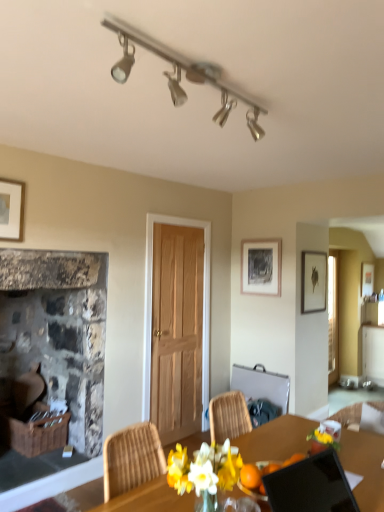
At what (x,y) coordinates should I click in order to perform the action: click on blank space situated above satin nickel track light at upper center (from a real-world perspective). Please return your answer as a coordinate pair (x, y). This screenshot has width=384, height=512. Looking at the image, I should click on (215, 73).